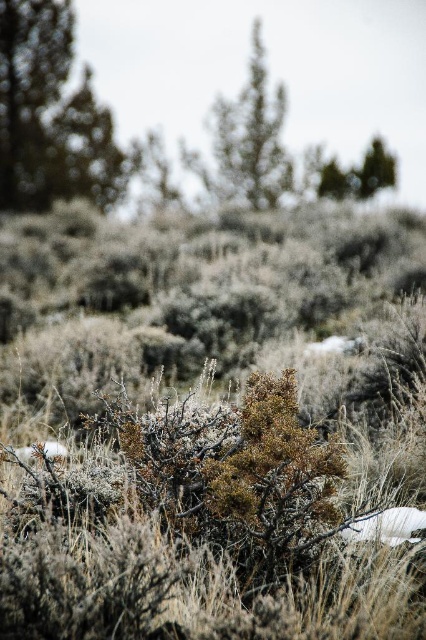
You are standing in a desert landscape and want to reach the point marked as point [78,113]. If your walking speed is 1.5 meters per second, how many seconds will it take you to reach that point?

The distance between you and point [78,113] is 29.80 meters. At a speed of 1.5 meters per second, it will take approximately 19.87 seconds to reach the point.

You are standing in the desert landscape and see two points marked in the image. Which point is closer to you, point (43, 172) or point (239, 106)?

Point (43, 172) is in front of point (239, 106), so it is closer to you.

You are standing at the center of the scene and want to locate the green textured tree at upper left. According to the coordinates provided, in which direction should you look to find it?

The green textured tree at upper left is located at coordinates point (51, 115), so you should look towards the upper left direction to find it.